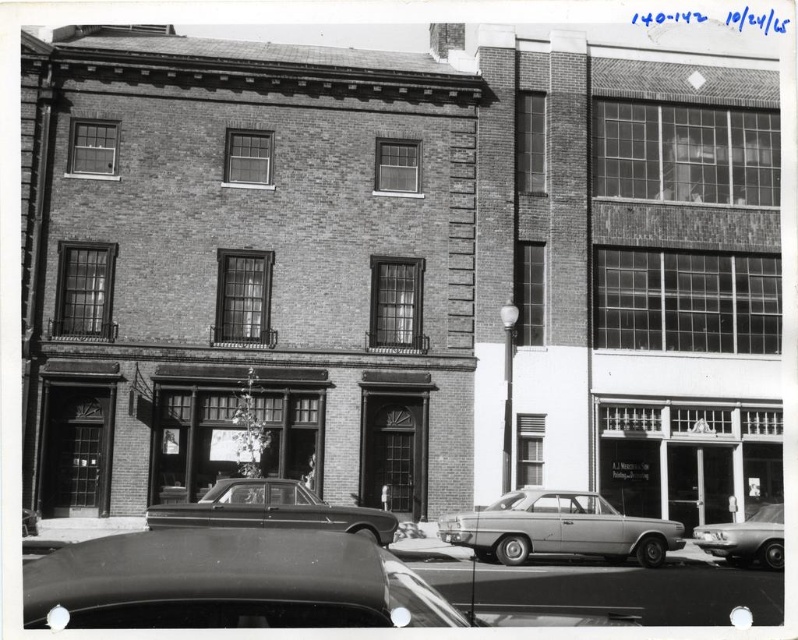
You are a pedestrian standing on the sidewalk in front of the building. You see the smooth glass storefront at center and the silver metallic sedan at center. Which object is positioned to the right of the other?

The smooth glass storefront at center is to the right of the silver metallic sedan at center according to the description.

You are standing on the sidewalk in front of the multi story brick building. You want to enter the smooth glass storefront at center. Which direction should you walk to reach it?

The smooth glass storefront at center is located at point [686,460], so you should walk towards the center of the building to reach it.

You are a delivery person standing at the shiny metallic sedan at center. You need to deliver a package to the smooth glass storefront at center. The delivery robot you use has a maximum range of 40 feet. Can the robot reach the storefront from your current position?

The distance between the smooth glass storefront at center and the shiny metallic sedan at center is 38.68 feet, which is within the robot s 40 feet range. Therefore, the robot can successfully reach the storefront.